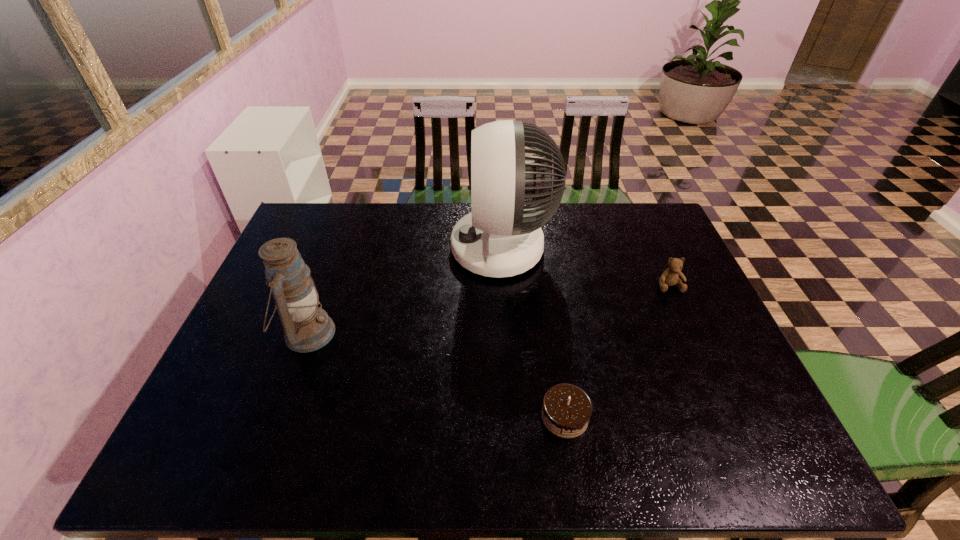
Identify the location of the tallest object. The image size is (960, 540). (501, 237).

Image resolution: width=960 pixels, height=540 pixels. Identify the location of the leftmost object. (307, 327).

You are a GUI agent. You are given a task and a screenshot of the screen. Output one action in this format:
    pyautogui.click(x=<x>, y=<y>)
    Task: Click on the oil lamp
    The image size is (960, 540).
    Given the screenshot: What is the action you would take?
    pyautogui.click(x=307, y=327)

Locate an element on the screen. the rightmost object is located at coordinates (670, 277).

The height and width of the screenshot is (540, 960). Find the location of `the nearest object`. the nearest object is located at coordinates (566, 411).

Find the location of a particular element. The height and width of the screenshot is (540, 960). vacant space located 0.100m on the grille of the tallest object is located at coordinates (420, 248).

Where is `free location located on the grille of the tallest object`? This screenshot has height=540, width=960. free location located on the grille of the tallest object is located at coordinates (332, 248).

Find the location of a particular element. free space located 0.360m on the grille of the tallest object is located at coordinates (338, 248).

At what (x,y) coordinates should I click in order to perform the action: click on free space located on the back of the third farthest object. Please return your answer as a coordinate pair (x, y). Looking at the image, I should click on (344, 234).

The width and height of the screenshot is (960, 540). Identify the location of blank space located 0.060m on the front-facing side of the rightmost object. (680, 309).